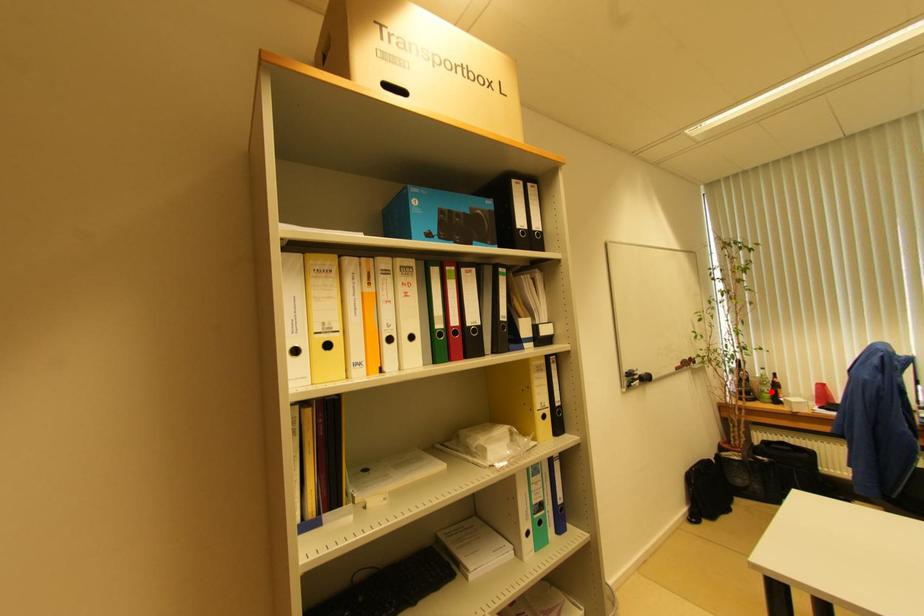
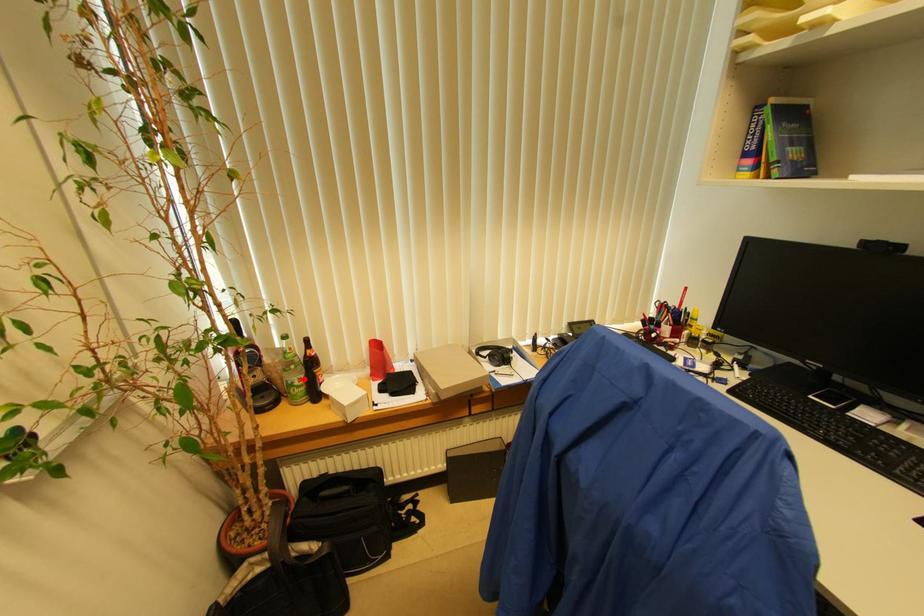
I am providing you with two images of the same scene from different viewpoints. A red point is marked on the first image and another point is marked on the second image. Does the point marked in image1 correspond to the same location as the one in image2?

Yes